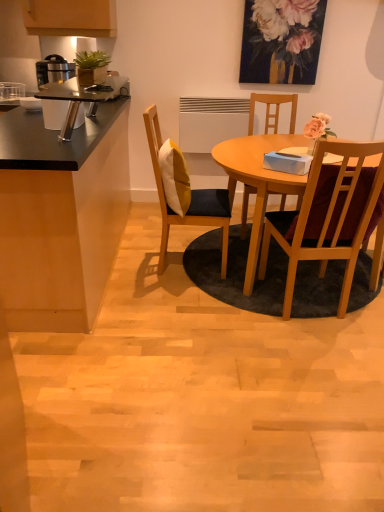
Question: Should I look upward or downward to see floral painting at upper center?

Choices:
 (A) up
 (B) down

Answer: (A)

Question: Is there a large distance between black matte cabinet at left and floral painting at upper center?

Choices:
 (A) no
 (B) yes

Answer: (B)

Question: From the image's perspective, is black matte cabinet at left under floral painting at upper center?

Choices:
 (A) no
 (B) yes

Answer: (B)

Question: Can you confirm if black matte cabinet at left is positioned to the right of floral painting at upper center?

Choices:
 (A) yes
 (B) no

Answer: (B)

Question: Considering the relative sizes of black matte cabinet at left and floral painting at upper center in the image provided, is black matte cabinet at left smaller than floral painting at upper center?

Choices:
 (A) no
 (B) yes

Answer: (A)

Question: Considering the relative positions of black matte cabinet at left and floral painting at upper center in the image provided, is black matte cabinet at left to the left of floral painting at upper center from the viewer's perspective?

Choices:
 (A) yes
 (B) no

Answer: (A)

Question: Is black matte cabinet at left completely or partially outside of floral painting at upper center?

Choices:
 (A) yes
 (B) no

Answer: (A)

Question: Is there a large distance between wooden chair with cushion at center, the 3th chair from the right, and wooden chair at center right, the 3th chair from the left?

Choices:
 (A) no
 (B) yes

Answer: (A)

Question: Is wooden chair with cushion at center, which ranks as the 1th chair in left-to-right order, facing away from wooden chair at center right, which ranks as the first chair in right-to-left order?

Choices:
 (A) yes
 (B) no

Answer: (B)

Question: Is wooden chair with cushion at center, the 3th chair from the right, bigger than wooden chair at center right, the 3th chair from the left?

Choices:
 (A) yes
 (B) no

Answer: (A)

Question: Is wooden chair with cushion at center, the 3th chair from the right, completely or partially outside of wooden chair at center right, the 3th chair from the left?

Choices:
 (A) no
 (B) yes

Answer: (B)

Question: Is wooden chair with cushion at center, the 3th chair from the right, next to wooden chair at center right, which ranks as the first chair in right-to-left order, and touching it?

Choices:
 (A) yes
 (B) no

Answer: (B)

Question: Considering the relative sizes of wooden chair with cushion at center, which ranks as the 1th chair in left-to-right order, and wooden chair at center right, the 3th chair from the left, in the image provided, is wooden chair with cushion at center, which ranks as the 1th chair in left-to-right order, shorter than wooden chair at center right, the 3th chair from the left,?

Choices:
 (A) no
 (B) yes

Answer: (A)

Question: Is black matte cabinet at left inside wooden chair with cushion at center, the 3th chair from the right?

Choices:
 (A) yes
 (B) no

Answer: (B)